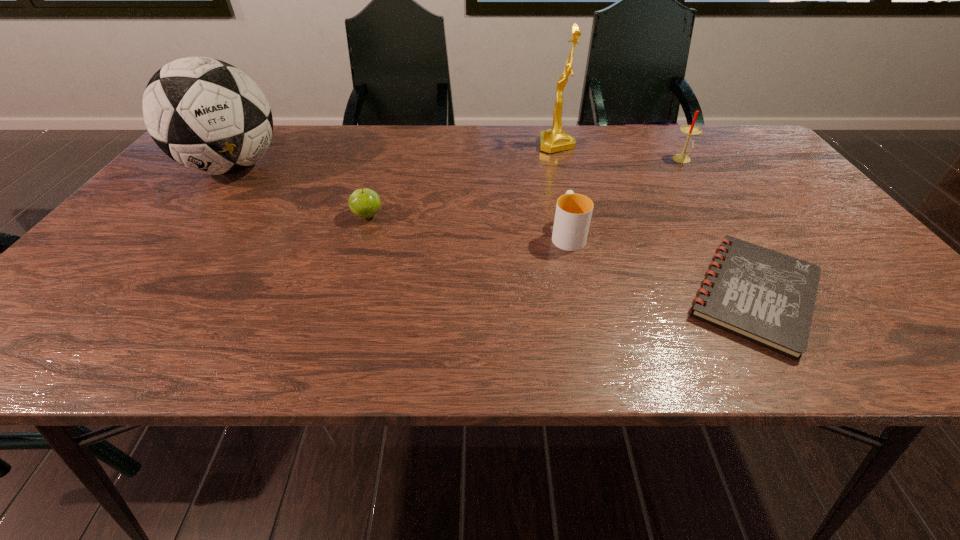
Find the location of a particular element. vacant area located 0.250m on the surface of the soccer ball where the brand logo is visible is located at coordinates (158, 262).

Image resolution: width=960 pixels, height=540 pixels. Identify the location of vacant area located on the left of the third tallest object. (552, 160).

The height and width of the screenshot is (540, 960). Identify the location of free space located with the handle on the side of the cup. (555, 180).

Identify the location of vacant space located with the handle on the side of the cup. (547, 144).

Locate an element on the screen. free space located 0.200m with the handle on the side of the cup is located at coordinates (554, 174).

Identify the location of vacant space located on the left of the second object from left to right. The width and height of the screenshot is (960, 540). (269, 216).

Where is `free space located 0.160m on the back of the shortest object`? free space located 0.160m on the back of the shortest object is located at coordinates pos(697,202).

The width and height of the screenshot is (960, 540). I want to click on award positioned at the far edge, so click(x=555, y=139).

Find the location of a particular element. The width and height of the screenshot is (960, 540). soccer ball at the far edge is located at coordinates (207, 115).

Where is `candle at the far edge`? Image resolution: width=960 pixels, height=540 pixels. candle at the far edge is located at coordinates (690, 130).